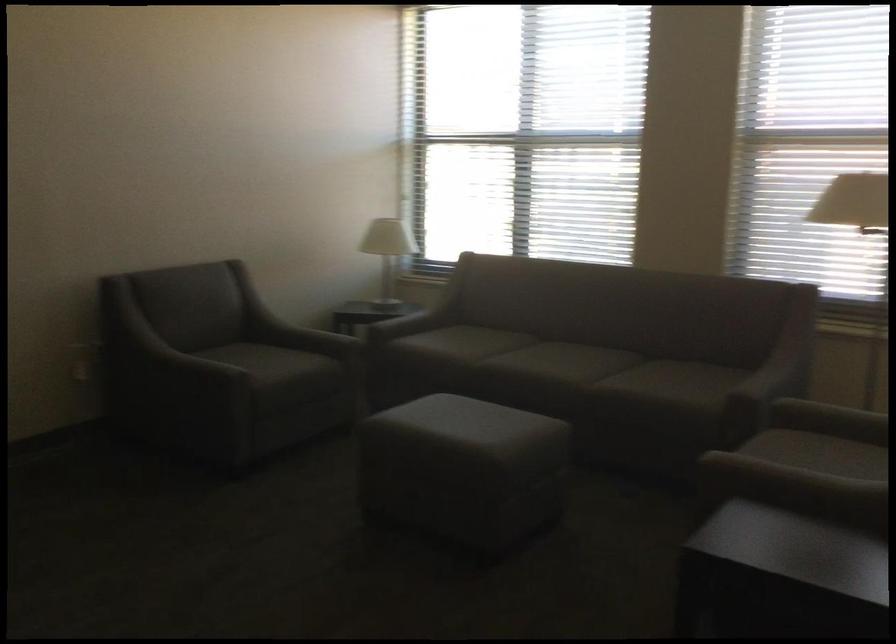
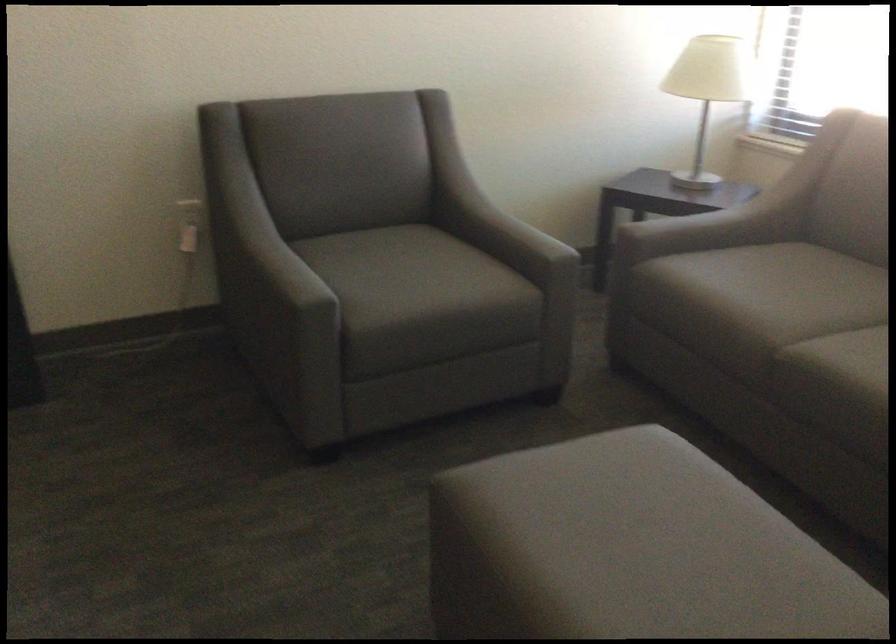
In the second image, find the point that corresponds to point (474, 337) in the first image.

(797, 292)